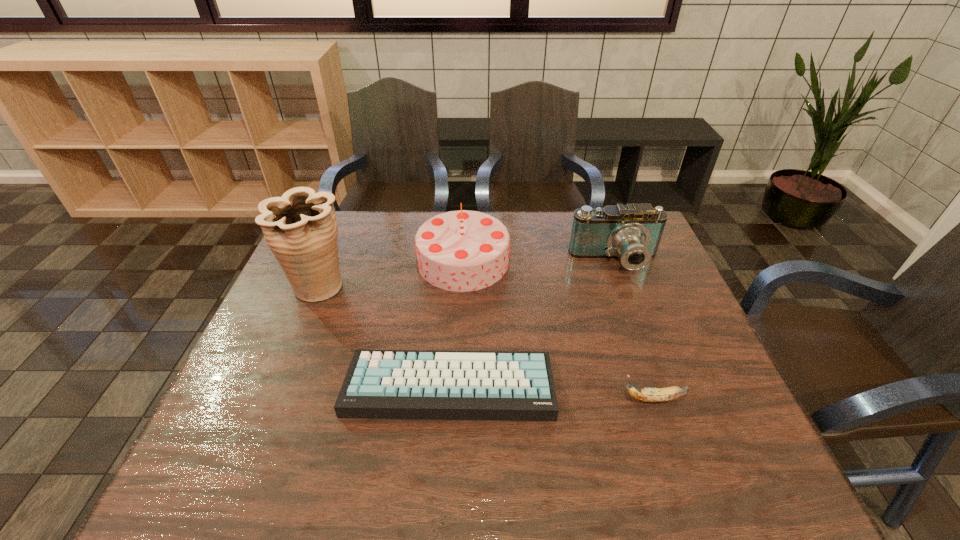
The width and height of the screenshot is (960, 540). Find the location of `blank space located at the stem of the second shortest object`. blank space located at the stem of the second shortest object is located at coordinates (528, 399).

What are the coordinates of `vacant position located 0.340m at the stem of the second shortest object` in the screenshot? It's located at (471, 399).

Where is `vacant space located on the back of the computer keyboard`? vacant space located on the back of the computer keyboard is located at coordinates (453, 332).

This screenshot has width=960, height=540. In order to click on birthday cake that is at the far edge in this screenshot , I will do pyautogui.click(x=463, y=250).

This screenshot has width=960, height=540. Find the location of `camcorder positioned at the far edge`. camcorder positioned at the far edge is located at coordinates (632, 232).

Where is `object that is at the left edge`? The width and height of the screenshot is (960, 540). object that is at the left edge is located at coordinates (300, 228).

Locate an element on the screen. Image resolution: width=960 pixels, height=540 pixels. camcorder located in the right edge section of the desktop is located at coordinates (632, 232).

Find the location of `banana located in the right edge section of the desktop`. banana located in the right edge section of the desktop is located at coordinates (673, 392).

Where is `object situated at the far right corner`? Image resolution: width=960 pixels, height=540 pixels. object situated at the far right corner is located at coordinates (632, 232).

The image size is (960, 540). In order to click on vacant space at the far edge in this screenshot , I will do `click(378, 245)`.